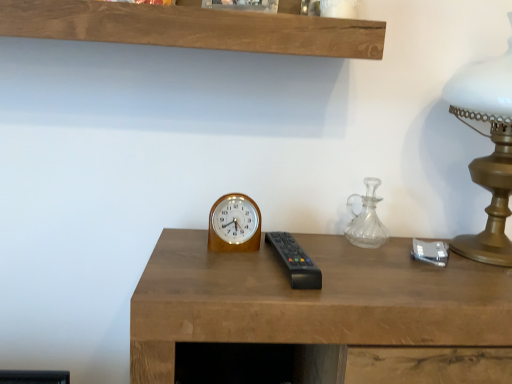
Where is `free space in front of wooden wall clock at center`? The image size is (512, 384). free space in front of wooden wall clock at center is located at coordinates (247, 305).